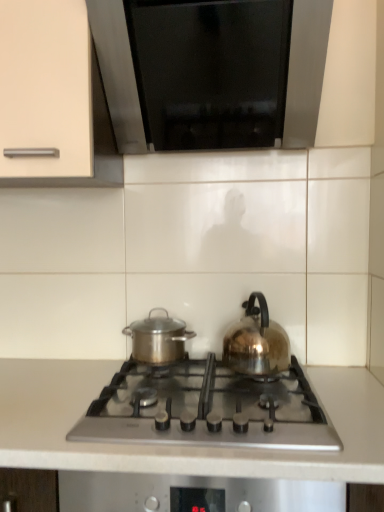
Question: Does white matte countertop at center have a larger size compared to satin silver gas stove at center?

Choices:
 (A) no
 (B) yes

Answer: (B)

Question: Is white matte countertop at center taller than satin silver gas stove at center?

Choices:
 (A) no
 (B) yes

Answer: (B)

Question: Is white matte countertop at center next to satin silver gas stove at center and touching it?

Choices:
 (A) no
 (B) yes

Answer: (A)

Question: Is white matte countertop at center wider than satin silver gas stove at center?

Choices:
 (A) yes
 (B) no

Answer: (A)

Question: Considering the relative positions of white matte countertop at center and satin silver gas stove at center in the image provided, is white matte countertop at center to the left of satin silver gas stove at center from the viewer's perspective?

Choices:
 (A) yes
 (B) no

Answer: (A)

Question: Visually, is white matte countertop at center positioned to the left or to the right of black glass at upper center?

Choices:
 (A) left
 (B) right

Answer: (A)

Question: Does point (97, 387) appear closer or farther from the camera than point (309, 53)?

Choices:
 (A) farther
 (B) closer

Answer: (A)

Question: Is white matte countertop at center wider or thinner than black glass at upper center?

Choices:
 (A) thin
 (B) wide

Answer: (B)

Question: Relative to black glass at upper center, is white matte countertop at center in front or behind?

Choices:
 (A) behind
 (B) front

Answer: (B)

Question: From a real-world perspective, is translucent glass kettle at right positioned above or below white matte countertop at center?

Choices:
 (A) below
 (B) above

Answer: (B)

Question: From the image's perspective, is translucent glass kettle at right above or below white matte countertop at center?

Choices:
 (A) below
 (B) above

Answer: (B)

Question: Is translucent glass kettle at right inside or outside of white matte countertop at center?

Choices:
 (A) inside
 (B) outside

Answer: (B)

Question: Relative to white matte countertop at center, is translucent glass kettle at right in front or behind?

Choices:
 (A) behind
 (B) front

Answer: (A)

Question: From a real-world perspective, is stainless steel pot at center physically located above or below translucent glass kettle at right?

Choices:
 (A) below
 (B) above

Answer: (A)

Question: Is stainless steel pot at center wider or thinner than translucent glass kettle at right?

Choices:
 (A) wide
 (B) thin

Answer: (B)